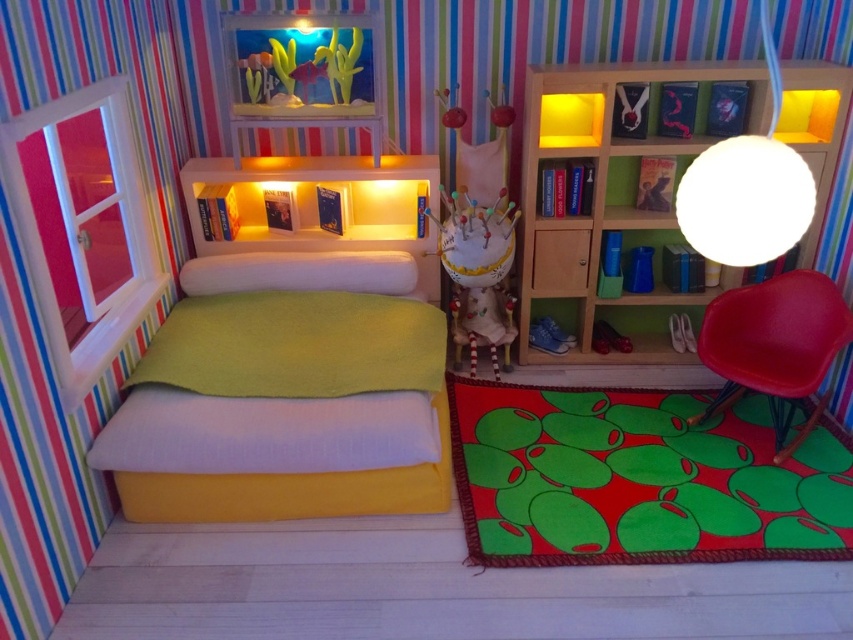
Question: Which object is farther from the camera taking this photo?

Choices:
 (A) soft white pillow at center
 (B) white fabric doll at center

Answer: (A)

Question: Which point is closer to the camera taking this photo?

Choices:
 (A) click(547, 259)
 (B) click(468, 292)
 (C) click(728, 148)

Answer: (C)

Question: Estimate the real-world distances between objects in this image. Which object is farther from the matte green fabric bed at center?

Choices:
 (A) matte red chair at lower right
 (B) white fabric doll at center
 (C) soft white pillow at center

Answer: (A)

Question: Does matte red chair at lower right appear on the right side of white fabric doll at center?

Choices:
 (A) yes
 (B) no

Answer: (A)

Question: From the image, what is the correct spatial relationship of matte green fabric bed at center in relation to white matte globe at upper right?

Choices:
 (A) left
 (B) right

Answer: (A)

Question: Observing the image, what is the correct spatial positioning of matte green fabric bed at center in reference to wooden bookshelf at upper right?

Choices:
 (A) above
 (B) below

Answer: (B)